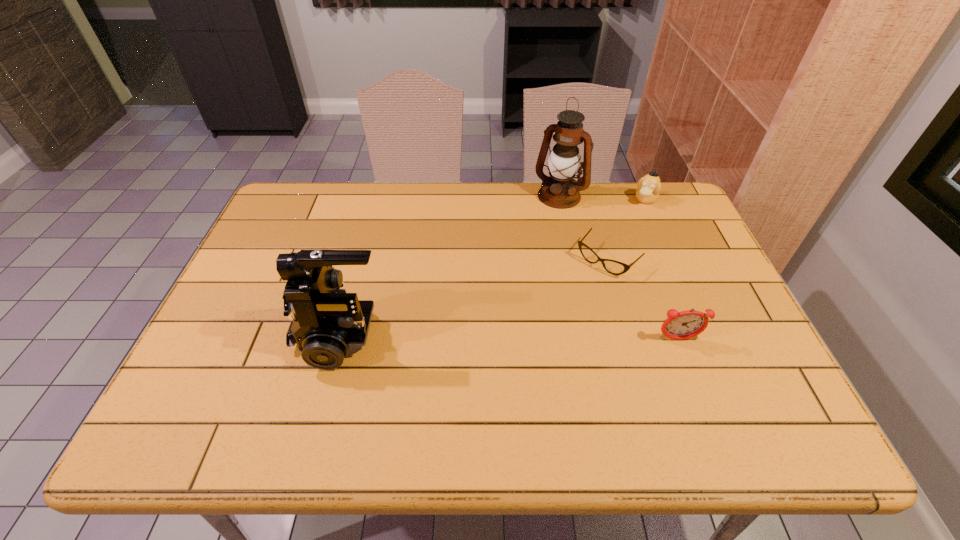
What are the coordinates of `camcorder` in the screenshot? It's located at (327, 323).

Where is `the fourth shortest object`? The width and height of the screenshot is (960, 540). the fourth shortest object is located at coordinates (327, 323).

I want to click on alarm clock, so click(682, 325).

Locate an element on the screen. the third nearest object is located at coordinates (613, 267).

Find the location of `the shortest object`. the shortest object is located at coordinates (613, 267).

Where is `duckling`? This screenshot has width=960, height=540. duckling is located at coordinates (649, 186).

Identify the location of the tallest object. (559, 190).

You are a GUI agent. You are given a task and a screenshot of the screen. Output one action in this format:
    pyautogui.click(x=<x>, y=<y>)
    Task: Click on the vacant region located 0.050m on the lens mount of the camcorder
    
    Given the screenshot: What is the action you would take?
    pyautogui.click(x=275, y=335)

This screenshot has height=540, width=960. I want to click on vacant space situated on the lens mount of the camcorder, so click(x=209, y=335).

Find the location of `free location located 0.150m on the front-facing side of the alarm clock`. free location located 0.150m on the front-facing side of the alarm clock is located at coordinates (701, 400).